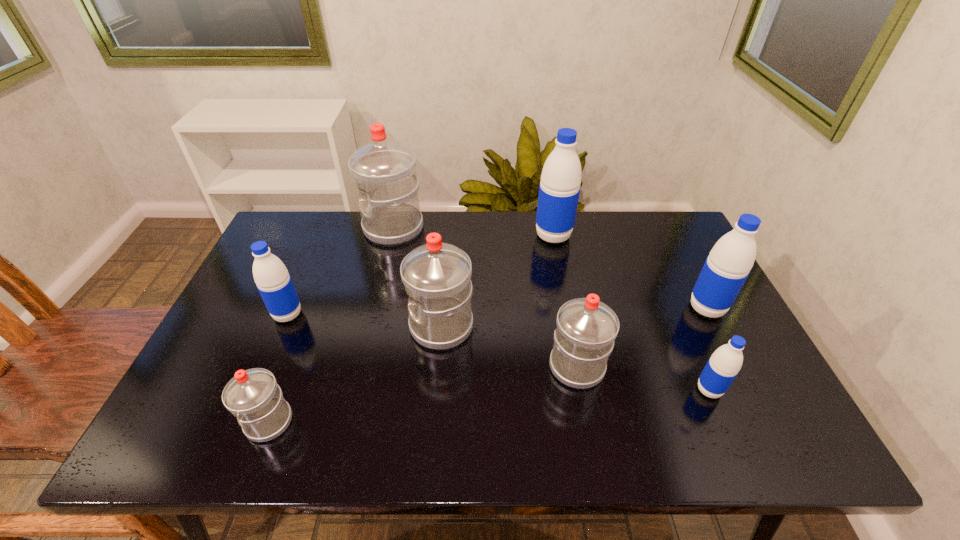
Where is `the second water bottle from right to left`? The image size is (960, 540). the second water bottle from right to left is located at coordinates click(x=723, y=366).

This screenshot has height=540, width=960. Find the location of `the third blue water bottle from left to right`. the third blue water bottle from left to right is located at coordinates pos(723,366).

Where is `the leftmost white water bottle`? Image resolution: width=960 pixels, height=540 pixels. the leftmost white water bottle is located at coordinates (253, 396).

Where is `the smallest white water bottle`? the smallest white water bottle is located at coordinates (253, 396).

I want to click on vacant space located on the front of the farthest blue water bottle, so click(x=567, y=310).

The image size is (960, 540). I want to click on vacant space situated 0.220m on the handle side of the sixth water bottle from right to left, so click(x=298, y=228).

The width and height of the screenshot is (960, 540). What are the coordinates of `vacant point located 0.250m on the handle side of the sixth water bottle from right to left` in the screenshot? It's located at (289, 228).

This screenshot has height=540, width=960. In order to click on free location located on the handle side of the sixth water bottle from right to left in this screenshot , I will do `click(340, 228)`.

Identify the location of vacant space located 0.190m on the left of the rightmost object. The height and width of the screenshot is (540, 960). (619, 308).

In order to click on free space located on the handle side of the second white water bottle from right to left in this screenshot , I will do `click(296, 326)`.